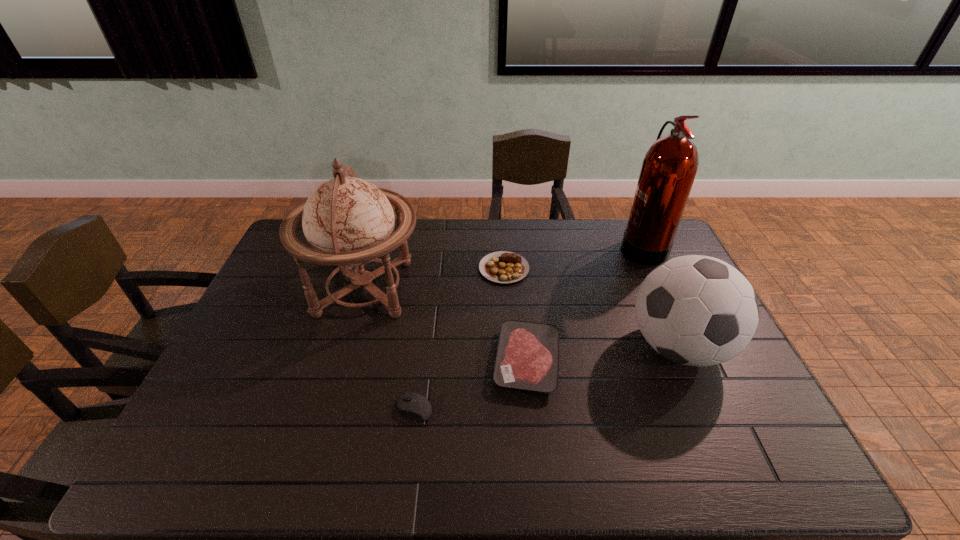
Identify the location of vacant area situated 0.050m on the left of the soccer ball. The image size is (960, 540). (610, 347).

Find the location of a particular element. The image size is (960, 540). free point located on the left of the farther steak is located at coordinates (444, 268).

Identify the location of free space located on the left of the nearer steak. The width and height of the screenshot is (960, 540). (347, 361).

Find the location of a particular element. The width and height of the screenshot is (960, 540). vacant region located on the back of the computer equipment is located at coordinates (426, 317).

Identify the location of fire extinguisher positioned at the far edge. Image resolution: width=960 pixels, height=540 pixels. (669, 168).

This screenshot has width=960, height=540. What are the coordinates of `globe positioned at the far edge` in the screenshot? It's located at (348, 222).

This screenshot has height=540, width=960. Find the location of `steak that is at the far edge`. steak that is at the far edge is located at coordinates (504, 267).

Locate an element on the screen. object present at the left edge is located at coordinates (348, 222).

At what (x,y) coordinates should I click in order to perform the action: click on fire extinguisher located at the right edge. Please return your answer as a coordinate pair (x, y). The image size is (960, 540). Looking at the image, I should click on (x=669, y=168).

You are a GUI agent. You are given a task and a screenshot of the screen. Output one action in this format:
    pyautogui.click(x=<x>, y=<y>)
    Task: Click on the soccer ball located in the right edge section of the desktop
    The width and height of the screenshot is (960, 540).
    Given the screenshot: What is the action you would take?
    pyautogui.click(x=695, y=310)